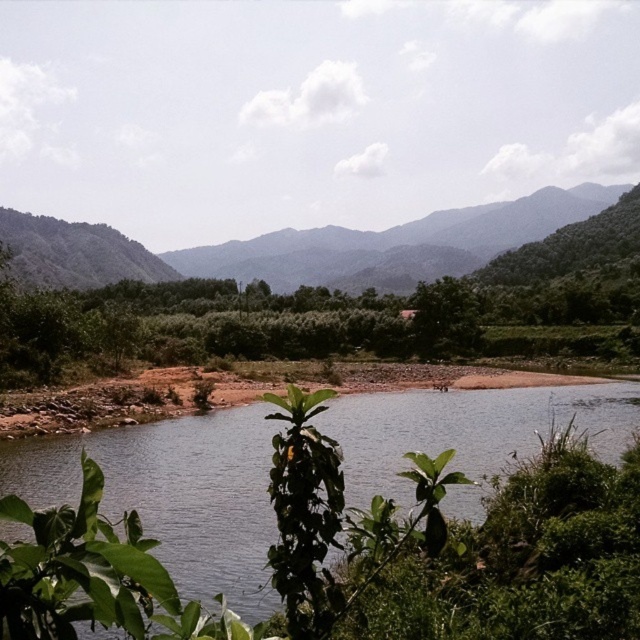
Is green leafy mountain at left wider than green leafy tree at center?

Yes.

Who is taller, green leafy mountain at left or green leafy tree at center?

Standing taller between the two is green leafy mountain at left.

Image resolution: width=640 pixels, height=640 pixels. What are the coordinates of `green leafy mountain at left` in the screenshot? It's located at (301, 246).

From the picture: Between clear water at center and green leafy mountain at left, which one appears on the right side from the viewer's perspective?

From the viewer's perspective, green leafy mountain at left appears more on the right side.

Is point (589, 388) closer to camera compared to point (304, 236)?

Yes, it is.

What are the coordinates of `clear water at center` in the screenshot? It's located at (196, 496).

Is clear water at center smaller than green leafy tree at center?

No.

Measure the distance between clear water at center and green leafy tree at center.

They are 141.31 feet apart.

Measure the distance between clear water at center and camera.

The distance of clear water at center from camera is 12.78 meters.

You are a GUI agent. You are given a task and a screenshot of the screen. Output one action in this format:
    pyautogui.click(x=<x>, y=<y>)
    Task: Click on the clear water at center
    
    Given the screenshot: What is the action you would take?
    pyautogui.click(x=196, y=496)